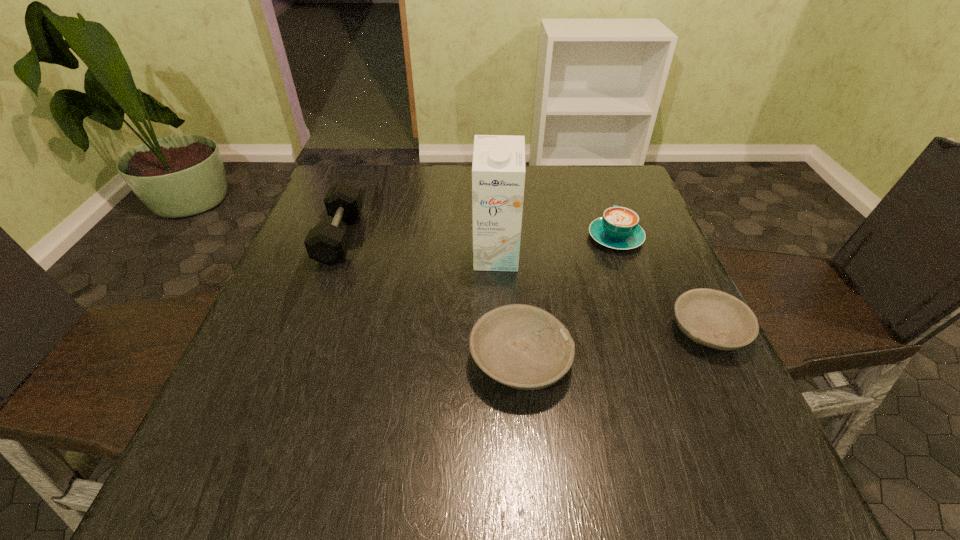
In order to click on free space at the left edge of the desktop in this screenshot , I will do `click(306, 268)`.

This screenshot has width=960, height=540. In order to click on vacant space at the right edge of the desktop in this screenshot , I will do `click(637, 213)`.

Find the location of a particular element. This screenshot has height=540, width=960. vacant space at the far left corner of the desktop is located at coordinates (372, 166).

Where is `vacant space at the near left corner of the desktop`? The height and width of the screenshot is (540, 960). vacant space at the near left corner of the desktop is located at coordinates (216, 417).

Find the location of a particular element. The height and width of the screenshot is (540, 960). empty space between the tallest object and the right bowl is located at coordinates (602, 294).

Where is `empty location between the cappuccino and the shortest object`? This screenshot has width=960, height=540. empty location between the cappuccino and the shortest object is located at coordinates (661, 284).

At what (x,y) coordinates should I click in order to perform the action: click on free space that is in between the taller bowl and the dumbbell. Please return your answer as a coordinate pair (x, y). This screenshot has height=540, width=960. Looking at the image, I should click on (430, 299).

What are the coordinates of `vacant area that lies between the cappuccino and the taller bowl` in the screenshot? It's located at (568, 299).

The width and height of the screenshot is (960, 540). I want to click on vacant region between the cappuccino and the tallest object, so point(556,247).

Identify the location of free area in between the tallest object and the second tallest object. click(418, 247).